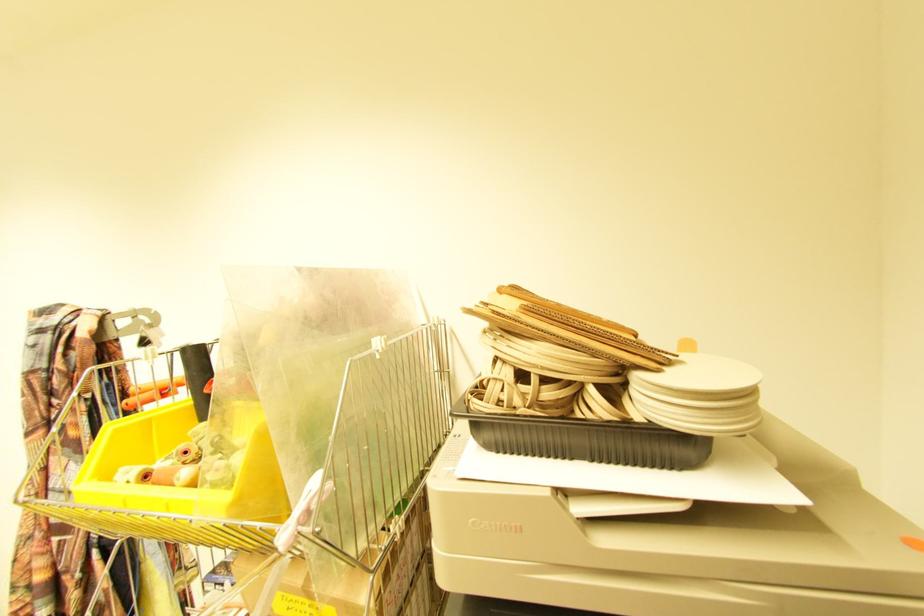
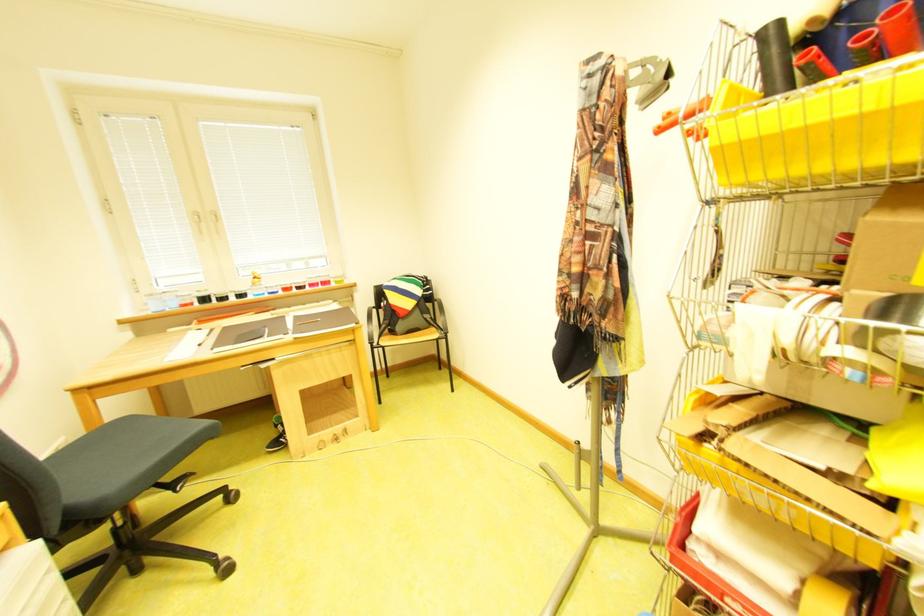
Find the pixel in the second image that matches the point at 198,350 in the first image.

(775, 33)